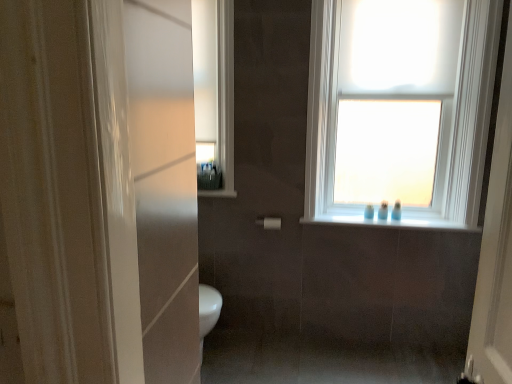
Locate an element on the screen. The image size is (512, 384). free space to the right of blue plastic toothbrushes at window, which appears as the third toiletry when viewed from the left is located at coordinates (411, 221).